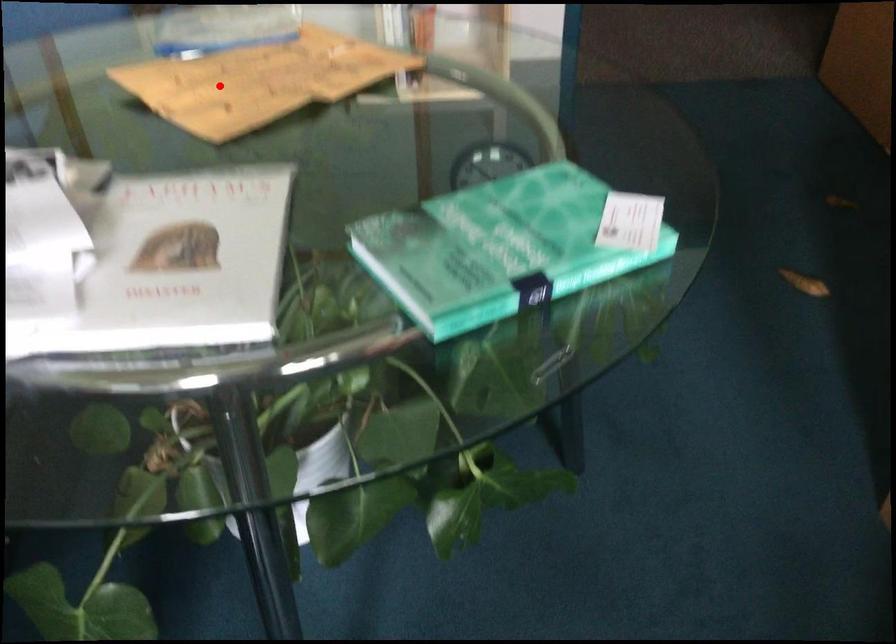
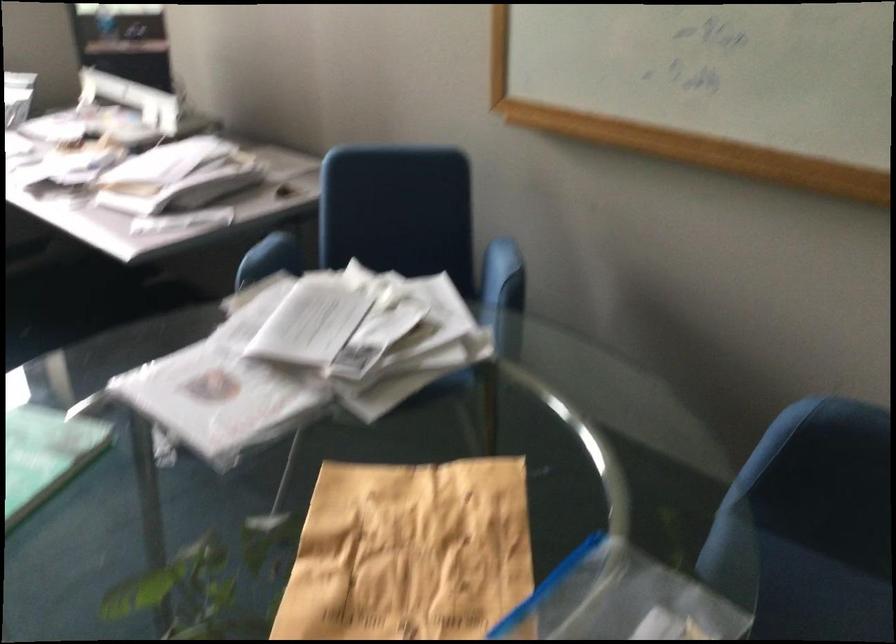
Question: I am providing you with two images of the same scene from different viewpoints. Given a red point in image1, look at the same physical point in image2. Is it:

Choices:
 (A) Closer to the viewpoint
 (B) Farther from the viewpoint

Answer: (A)